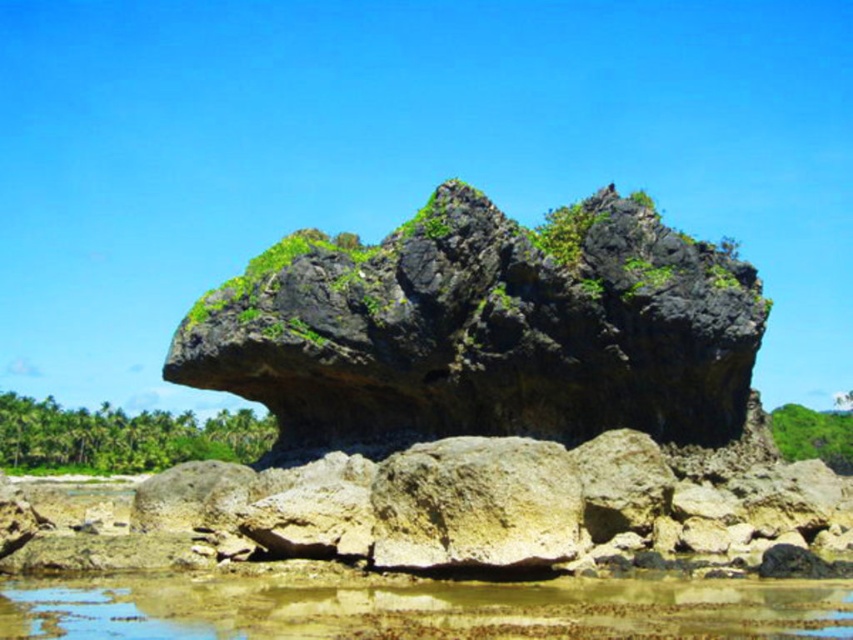
You are standing on the beach and want to walk from your current position to the clear water at lower center. There is a green mossy rock at center in your way. Which direction should you move to go around it and reach the water?

Since the green mossy rock at center is closer to you than the clear water at lower center, you should move either to the left or right of the green mossy rock at center to reach the clear water at lower center.

You are a geologist examining the rock formation. You need to determine if the green mossy rock at center is submerged in the clear water at lower center. Based on the scene description, what can you conclude?

The green mossy rock at center is positioned over clear water at lower center, so it is likely partially submerged in the water.